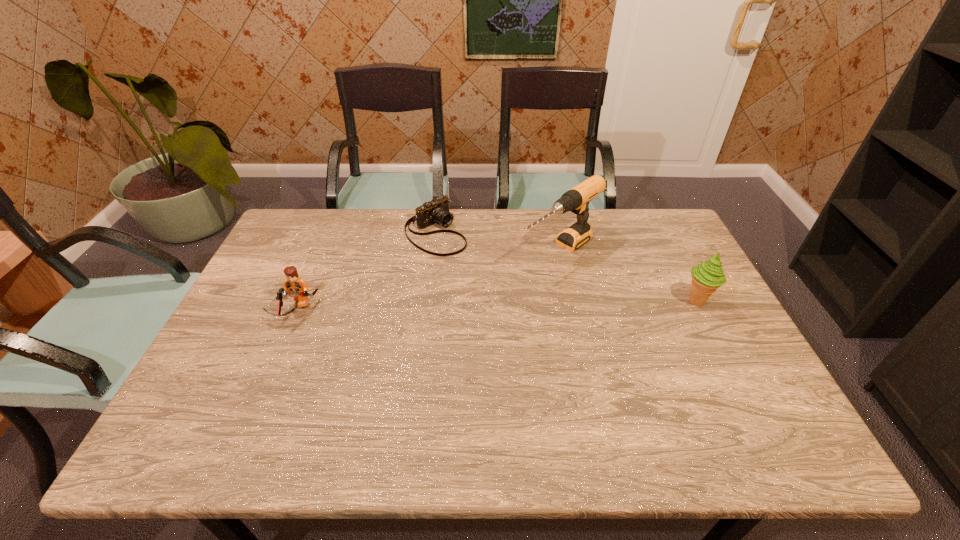
Where is `empty space between the drill and the shortest object`? This screenshot has width=960, height=540. empty space between the drill and the shortest object is located at coordinates (498, 241).

Locate an element on the screen. vacant space that's between the tallest object and the third object from right to left is located at coordinates (498, 241).

Image resolution: width=960 pixels, height=540 pixels. Identify the location of free area in between the third object from right to left and the rightmost object. (566, 266).

This screenshot has height=540, width=960. What are the coordinates of `vacant area between the leftmost object and the icecream` in the screenshot? It's located at (496, 306).

At what (x,y) coordinates should I click in order to perform the action: click on unoccupied area between the Lego and the tallest object. Please return your answer as a coordinate pair (x, y). Looking at the image, I should click on click(427, 280).

The height and width of the screenshot is (540, 960). Find the location of `empty space between the third object from left to right and the shortest object`. empty space between the third object from left to right and the shortest object is located at coordinates (498, 241).

Choose which object is the third nearest neighbor to the icecream. Please provide its 2D coordinates. Your answer should be formatted as a tuple, i.e. [(x, y)], where the tuple contains the x and y coordinates of a point satisfying the conditions above.

[(294, 285)]

Identify which object is the second nearest to the drill. Please provide its 2D coordinates. Your answer should be formatted as a tuple, i.e. [(x, y)], where the tuple contains the x and y coordinates of a point satisfying the conditions above.

[(706, 277)]

Locate an element on the screen. This screenshot has width=960, height=540. free spot that satisfies the following two spatial constraints: 1. on the front side of the camera; 2. on the left side of the icecream is located at coordinates (427, 301).